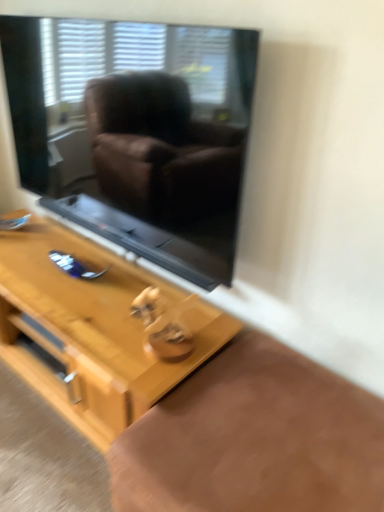
Question: Considering their positions, is light wood table at center located in front of or behind black glass window screen at upper center?

Choices:
 (A) behind
 (B) front

Answer: (A)

Question: Considering the positions of light wood table at center and black glass window screen at upper center in the image, is light wood table at center wider or thinner than black glass window screen at upper center?

Choices:
 (A) wide
 (B) thin

Answer: (A)

Question: From a real-world perspective, is light wood table at center physically located above or below black glass window screen at upper center?

Choices:
 (A) above
 (B) below

Answer: (B)

Question: Which is correct: black glass window screen at upper center is inside light wood table at center, or outside of it?

Choices:
 (A) outside
 (B) inside

Answer: (A)

Question: Looking at the image, does black glass window screen at upper center seem bigger or smaller compared to light wood table at center?

Choices:
 (A) big
 (B) small

Answer: (B)

Question: From their relative heights in the image, would you say black glass window screen at upper center is taller or shorter than light wood table at center?

Choices:
 (A) tall
 (B) short

Answer: (A)

Question: Is black glass window screen at upper center wider or thinner than light wood table at center?

Choices:
 (A) thin
 (B) wide

Answer: (A)